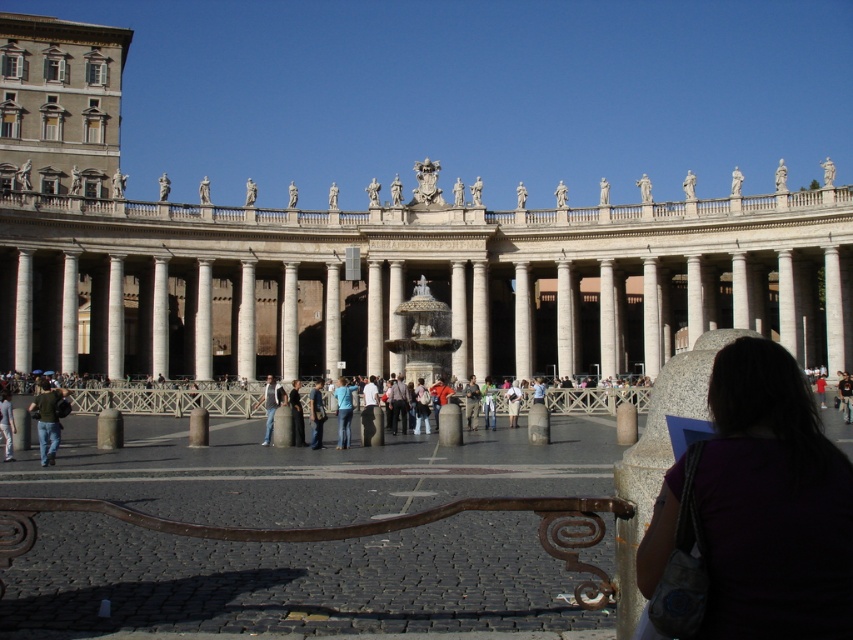
Is point (148, 262) positioned behind point (486, 419)?

Yes, point (148, 262) is farther from viewer.

Does white marble palace at center have a larger size compared to denim jacket at center?

Yes.

Locate an element on the screen. The width and height of the screenshot is (853, 640). white marble palace at center is located at coordinates [x=386, y=244].

Does white marble palace at center appear on the left side of green fabric jacket at lower left?

Incorrect, white marble palace at center is not on the left side of green fabric jacket at lower left.

Which is behind, point (317, 328) or point (51, 426)?

The point (317, 328) is more distant.

In order to click on white marble palace at center in this screenshot , I will do `click(386, 244)`.

Locate an element on the screen. The image size is (853, 640). purple fabric at lower right is located at coordinates (772, 502).

Which is more to the right, purple fabric at lower right or blue denim jeans at center?

From the viewer's perspective, purple fabric at lower right appears more on the right side.

Does point (698, 634) come farther from viewer compared to point (341, 448)?

No, (698, 634) is in front of (341, 448).

You are a GUI agent. You are given a task and a screenshot of the screen. Output one action in this format:
    pyautogui.click(x=<x>, y=<y>)
    Task: Click on the purple fabric at lower right
    This screenshot has width=853, height=640.
    Given the screenshot: What is the action you would take?
    pyautogui.click(x=772, y=502)